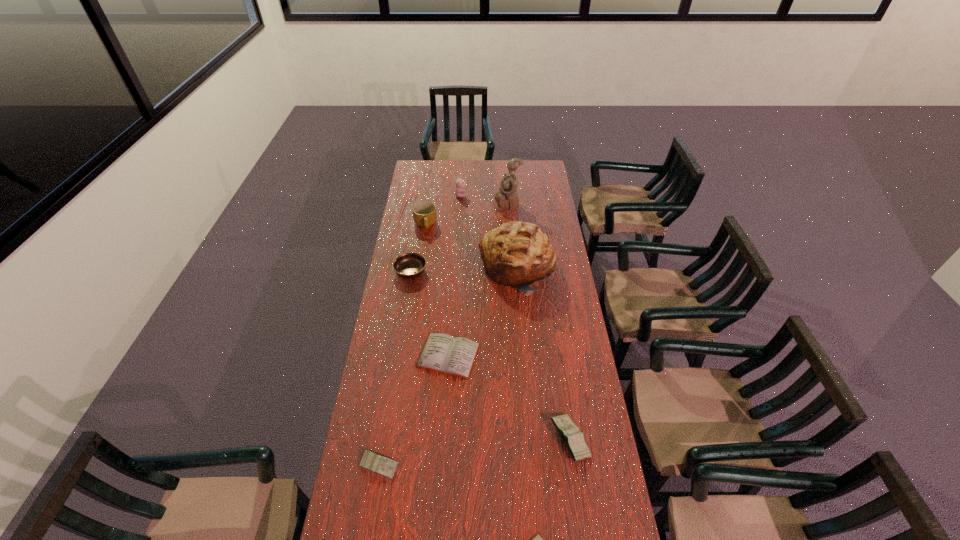
Find the location of a particular element. The height and width of the screenshot is (540, 960). object that is the sixth closest to the tallest object is located at coordinates (574, 441).

Find the location of a particular element. The image size is (960, 540). diary that is the third closest to the farthest diary is located at coordinates (537, 539).

Where is `the closest diary to the eighth shortest object`? The height and width of the screenshot is (540, 960). the closest diary to the eighth shortest object is located at coordinates (453, 355).

Locate which white diary is the second closest to the bread. Please provide its 2D coordinates. Your answer should be formatted as a tuple, i.e. [(x, y)], where the tuple contains the x and y coordinates of a point satisfying the conditions above.

[(537, 539)]

Identify the location of vacant region that satisfies the following two spatial constraints: 1. on the front-facing side of the figurine; 2. on the right side of the bread. This screenshot has width=960, height=540. (513, 268).

Locate an element on the screen. This screenshot has width=960, height=540. vacant area that satisfies the following two spatial constraints: 1. on the back side of the second tallest object; 2. on the front-facing side of the figurine is located at coordinates coord(512,204).